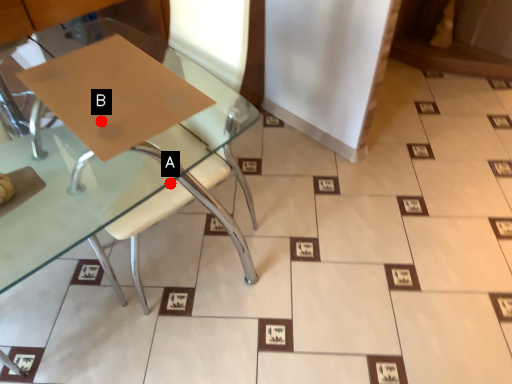
Question: Two points are circled on the image, labeled by A and B beside each circle. Which of the following is the farthest from the observer?

Choices:
 (A) A is further
 (B) B is further

Answer: (A)